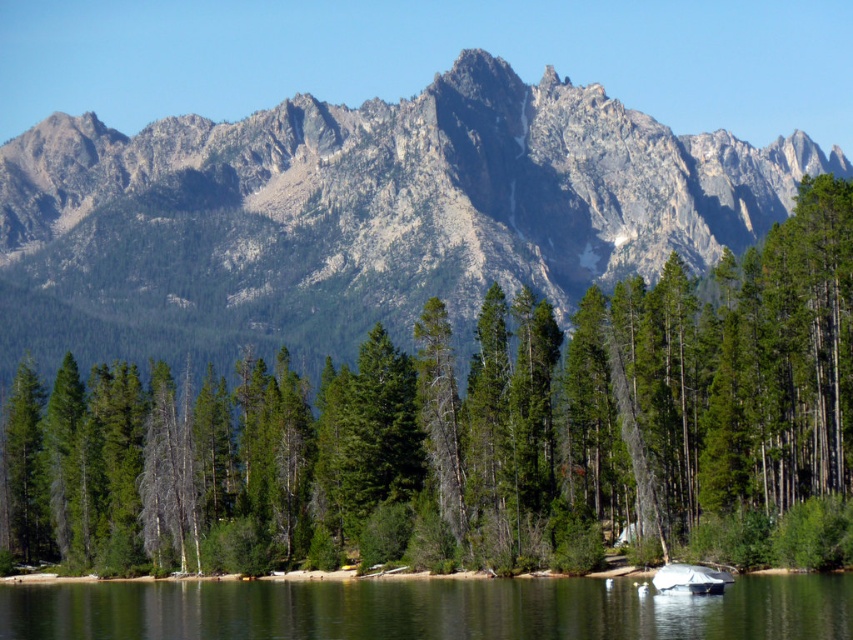
Question: Estimate the real-world distances between objects in this image. Which object is farther from the green matte tree at center?

Choices:
 (A) rocky gray mountain range at upper center
 (B) clear water at lower center

Answer: (A)

Question: Is rocky gray mountain range at upper center bigger than clear water at lower center?

Choices:
 (A) no
 (B) yes

Answer: (B)

Question: Is rocky gray mountain range at upper center closer to camera compared to clear water at lower center?

Choices:
 (A) no
 (B) yes

Answer: (A)

Question: Which of the following is the closest to the observer?

Choices:
 (A) green matte tree at center
 (B) clear water at lower center

Answer: (B)

Question: Does green matte tree at center have a larger size compared to clear water at lower center?

Choices:
 (A) yes
 (B) no

Answer: (A)

Question: Which point is closer to the camera?

Choices:
 (A) (461, 52)
 (B) (10, 593)

Answer: (B)